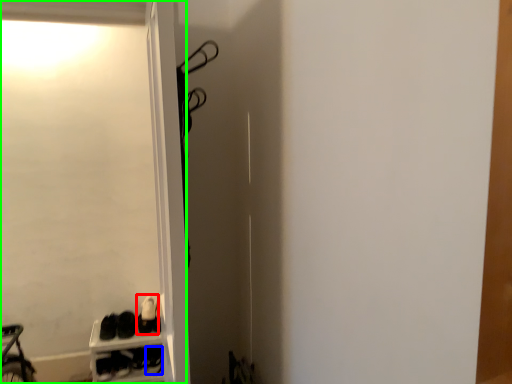
Question: Which object is positioned closest to footwear (highlighted by a red box)? Select from shoe (highlighted by a blue box) and screen door (highlighted by a green box).

Choices:
 (A) shoe
 (B) screen door

Answer: (A)